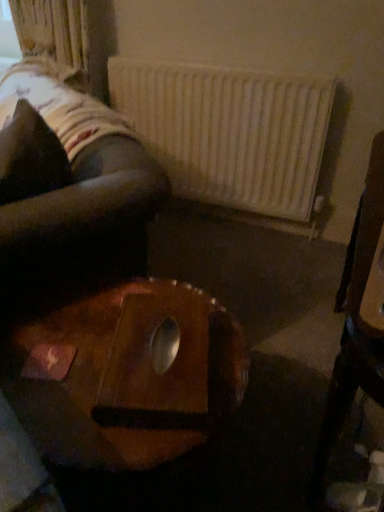
What do you see at coordinates (358, 317) in the screenshot? I see `wooden chair at right` at bounding box center [358, 317].

I want to click on velvety black pillow at upper left, so click(30, 157).

Is wooden chair at right beside velvety black pillow at upper left?

wooden chair at right is not next to velvety black pillow at upper left, and they're not touching.

Is velvety black pillow at upper left surrounded by wooden chair at right?

That's incorrect, velvety black pillow at upper left is not inside wooden chair at right.

Does point (336, 433) come farther from viewer compared to point (47, 135)?

That is False.

Which object is wider, wooden chair at right or velvety black pillow at upper left?

Wider between the two is velvety black pillow at upper left.

From a real-world perspective, is white matte radiator at upper center physically located above or below wooden chair at right?

In terms of real-world spatial position, white matte radiator at upper center is above wooden chair at right.

Is white matte radiator at upper center facing away from wooden chair at right?

white matte radiator at upper center is not turned away from wooden chair at right.

Could wooden chair at right be considered to be inside white matte radiator at upper center?

No, wooden chair at right is not surrounded by white matte radiator at upper center.

From the image's perspective, is white matte radiator at upper center located above wooden chair at right?

Yes, from the image's perspective, white matte radiator at upper center is over wooden chair at right.

Does wooden chair at right have a lesser height compared to white matte radiator at upper center?

Yes.

The width and height of the screenshot is (384, 512). Find the location of `radiator that appears above the wooden chair at right (from the image's perspective)`. radiator that appears above the wooden chair at right (from the image's perspective) is located at coordinates (232, 137).

Is wooden chair at right wider than white matte radiator at upper center?

Yes, wooden chair at right is wider than white matte radiator at upper center.

Is velvety black pillow at upper left looking in the opposite direction of wooden table at center?

No, velvety black pillow at upper left is not facing the opposite direction of wooden table at center.

Is point (55, 163) closer or farther from the camera than point (73, 437)?

Point (55, 163).

From a real-world perspective, is wooden table at center physically located above or below white matte radiator at upper center?

From a real-world perspective, wooden table at center is physically below white matte radiator at upper center.

In the scene shown: Is wooden table at center to the left or to the right of white matte radiator at upper center in the image?

From the image, it's evident that wooden table at center is to the left of white matte radiator at upper center.

Considering the positions of objects wooden table at center and white matte radiator at upper center in the image provided, who is in front, wooden table at center or white matte radiator at upper center?

wooden table at center is more forward.

Find the location of a particular element. The image size is (384, 512). table directly beneath the white matte radiator at upper center (from a real-world perspective) is located at coordinates (125, 375).

Looking at their sizes, would you say wooden chair at right is wider or thinner than wooden table at center?

Considering their sizes, wooden chair at right looks slimmer than wooden table at center.

Where is `furniture that is on the right side of wooden table at center`? This screenshot has height=512, width=384. furniture that is on the right side of wooden table at center is located at coordinates (358, 317).

Between point (362, 309) and point (203, 385), which one is positioned in front?

The point (362, 309) is closer.

From a real-world perspective, between wooden chair at right and wooden table at center, who is vertically higher?

From a 3D spatial view, wooden chair at right is above.

Considering the relative sizes of white matte radiator at upper center and velvety black pillow at upper left in the image provided, is white matte radiator at upper center bigger than velvety black pillow at upper left?

Correct, white matte radiator at upper center is larger in size than velvety black pillow at upper left.

Would you say velvety black pillow at upper left is part of white matte radiator at upper center's contents?

Actually, velvety black pillow at upper left is outside white matte radiator at upper center.

Which point is more distant from viewer, (153, 69) or (15, 199)?

The point (153, 69) is farther.

Can you confirm if white matte radiator at upper center is thinner than velvety black pillow at upper left?

Indeed, white matte radiator at upper center has a lesser width compared to velvety black pillow at upper left.

Identify the location of pillow behind the wooden chair at right. (30, 157).

Identify the location of furniture below the white matte radiator at upper center (from a real-world perspective). The image size is (384, 512). (358, 317).

Looking at this image, which object lies further to the anchor point wooden chair at right, wooden table at center or velvety black pillow at upper left?

velvety black pillow at upper left.

From the image, which object appears to be nearer to velvety black pillow at upper left, wooden table at center or white matte radiator at upper center?

Based on the image, wooden table at center appears to be nearer to velvety black pillow at upper left.

Based on their spatial positions, is velvety black pillow at upper left or white matte radiator at upper center further from wooden table at center?

Among the two, white matte radiator at upper center is located further to wooden table at center.

Which object lies further to the anchor point wooden chair at right, velvety black pillow at upper left or wooden table at center?

The object further to wooden chair at right is velvety black pillow at upper left.

Looking at the image, which one is located further to white matte radiator at upper center, wooden chair at right or velvety black pillow at upper left?

wooden chair at right.

Which object lies nearer to the anchor point wooden table at center, white matte radiator at upper center or velvety black pillow at upper left?

Among the two, velvety black pillow at upper left is located nearer to wooden table at center.

Considering their positions, is white matte radiator at upper center positioned further to wooden chair at right than wooden table at center?

Based on the image, white matte radiator at upper center appears to be further to wooden chair at right.

Looking at the image, which one is located closer to white matte radiator at upper center, wooden chair at right or wooden table at center?

Among the two, wooden chair at right is located nearer to white matte radiator at upper center.

I want to click on table between wooden chair at right and white matte radiator at upper center along the z-axis, so click(x=125, y=375).

This screenshot has width=384, height=512. What are the coordinates of `pillow between wooden chair at right and white matte radiator at upper center along the z-axis` in the screenshot? It's located at (30, 157).

Where is `pillow between wooden table at center and white matte radiator at upper center along the z-axis`? pillow between wooden table at center and white matte radiator at upper center along the z-axis is located at coordinates (30, 157).

Where is `table situated between velvety black pillow at upper left and wooden chair at right from left to right`? Image resolution: width=384 pixels, height=512 pixels. table situated between velvety black pillow at upper left and wooden chair at right from left to right is located at coordinates [125, 375].